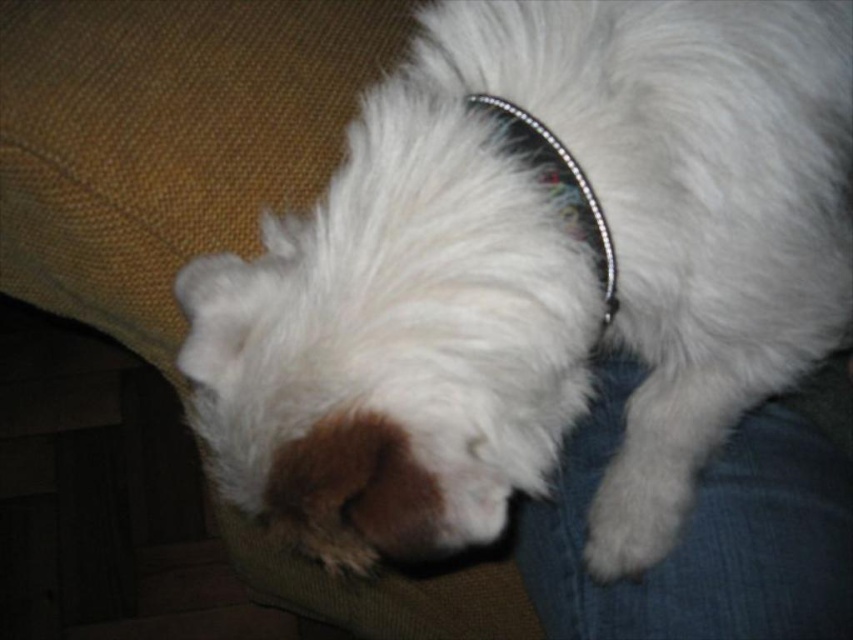
Question: Which point is farther to the camera?

Choices:
 (A) (606, 244)
 (B) (839, 33)

Answer: (B)

Question: Where is white fluffy dog at center located in relation to sparkly silver dog collar at center in the image?

Choices:
 (A) above
 (B) below

Answer: (B)

Question: Can you confirm if white fluffy dog at center is thinner than sparkly silver dog collar at center?

Choices:
 (A) yes
 (B) no

Answer: (B)

Question: Does white fluffy dog at center have a larger size compared to sparkly silver dog collar at center?

Choices:
 (A) no
 (B) yes

Answer: (B)

Question: Which of the following is the farthest from the observer?

Choices:
 (A) sparkly silver dog collar at center
 (B) white fluffy dog at center

Answer: (A)

Question: Which object appears closest to the camera in this image?

Choices:
 (A) sparkly silver dog collar at center
 (B) white fluffy dog at center

Answer: (B)